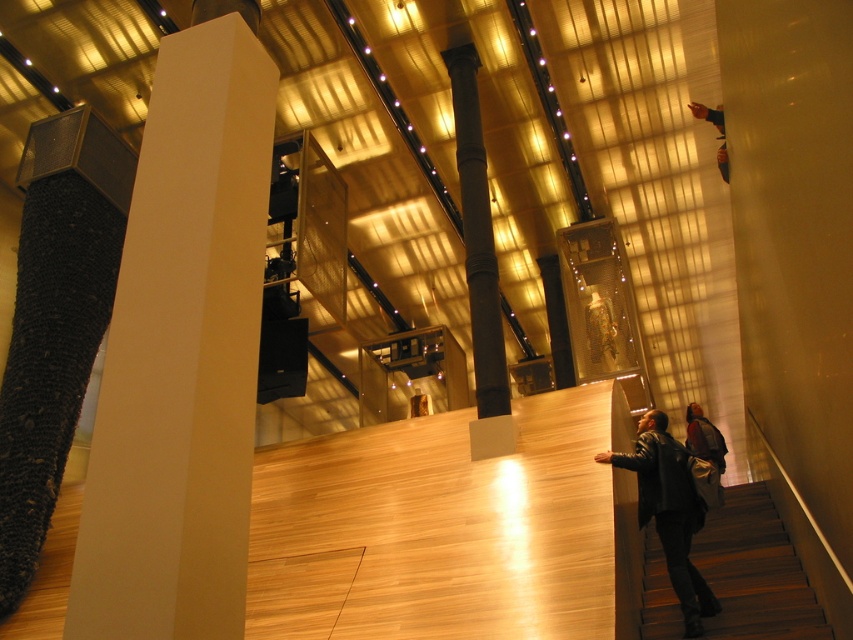
Which is below, dark brown leather jacket at lower right or blue fabric at upper right?

dark brown leather jacket at lower right is lower down.

The image size is (853, 640). Describe the element at coordinates (704, 436) in the screenshot. I see `dark brown leather jacket at lower right` at that location.

Identify the location of dark brown leather jacket at lower right. The width and height of the screenshot is (853, 640). point(704,436).

Can you confirm if wooden stairs at lower right is wider than black matte column at center?

Indeed, wooden stairs at lower right has a greater width compared to black matte column at center.

Measure the distance between wooden stairs at lower right and camera.

They are 18.87 feet apart.

The image size is (853, 640). In order to click on wooden stairs at lower right in this screenshot , I will do `click(755, 572)`.

The height and width of the screenshot is (640, 853). I want to click on wooden stairs at lower right, so click(x=755, y=572).

Does black matte column at center come in front of dark brown leather jacket at lower right?

Yes, black matte column at center is closer to the viewer.

This screenshot has width=853, height=640. I want to click on black matte column at center, so click(477, 236).